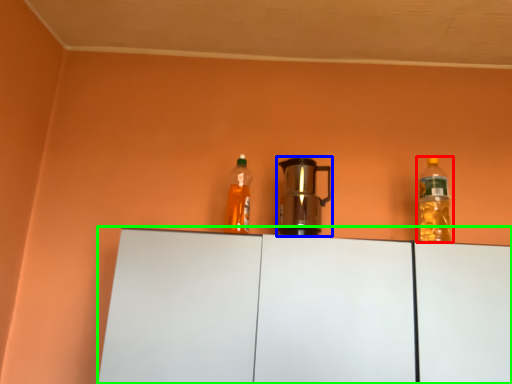
Question: Which is nearer to the bottle (highlighted by a red box)? kitchen appliance (highlighted by a blue box) or cabinetry (highlighted by a green box).

Choices:
 (A) kitchen appliance
 (B) cabinetry

Answer: (A)